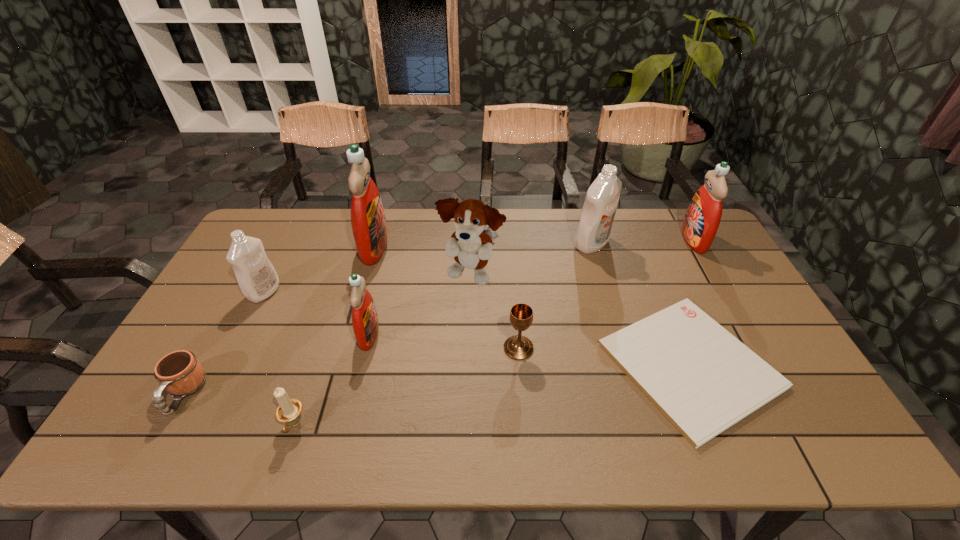
The width and height of the screenshot is (960, 540). I want to click on the nearest detergent, so click(x=365, y=323).

This screenshot has width=960, height=540. I want to click on chalice, so coord(518,347).

Image resolution: width=960 pixels, height=540 pixels. I want to click on candle_holder, so click(288, 411).

The image size is (960, 540). Find the location of `the second shortest object`. the second shortest object is located at coordinates (180, 373).

Where is `clipboard`? The width and height of the screenshot is (960, 540). clipboard is located at coordinates (703, 379).

Where is `free space located on the front surface of the tallest object`? This screenshot has width=960, height=540. free space located on the front surface of the tallest object is located at coordinates (438, 247).

This screenshot has height=540, width=960. In order to click on free space located on the front of the second detergent from right to left in this screenshot , I will do `click(609, 303)`.

At what (x,y) coordinates should I click in order to perform the action: click on vacant region located on the front surface of the rightmost detergent. Please return your answer as a coordinate pair (x, y). Looking at the image, I should click on (568, 240).

The height and width of the screenshot is (540, 960). I want to click on vacant point located 0.320m on the front surface of the rightmost detergent, so click(x=591, y=240).

I want to click on vacant area situated on the front surface of the rightmost detergent, so click(635, 240).